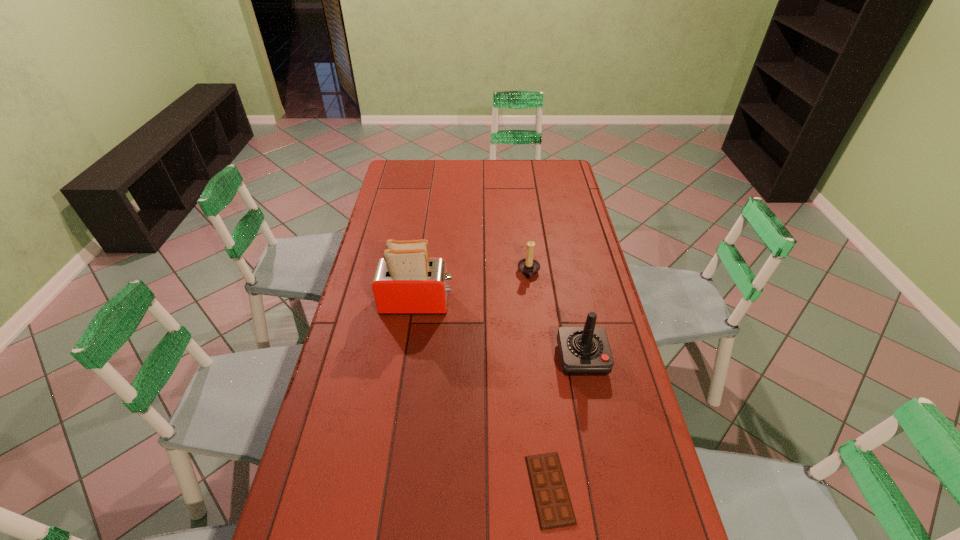
I want to click on the tallest object, so click(x=406, y=282).

The image size is (960, 540). Find the location of `the second farthest object`. the second farthest object is located at coordinates (406, 282).

This screenshot has width=960, height=540. I want to click on the third farthest object, so (584, 351).

I want to click on the rightmost object, so click(x=584, y=351).

I want to click on candle holder, so click(x=528, y=266).

What are the coordinates of `the farthest object` in the screenshot? It's located at (528, 266).

You are a GUI agent. You are given a task and a screenshot of the screen. Output one action in this format:
    pyautogui.click(x=<x>, y=<y>)
    Task: Click on the nearest object
    
    Given the screenshot: What is the action you would take?
    pyautogui.click(x=552, y=501)

I want to click on the shortest object, so click(x=552, y=501).

This screenshot has width=960, height=540. I want to click on vacant space located on the front-facing side of the leftmost object, so click(x=517, y=303).

I want to click on free location located on the front-facing side of the rightmost object, so click(x=601, y=448).